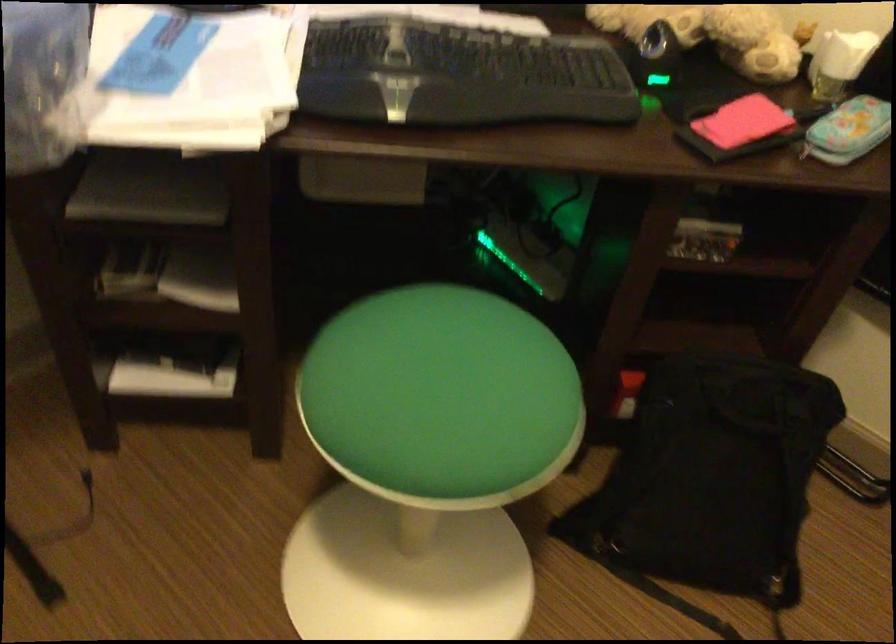
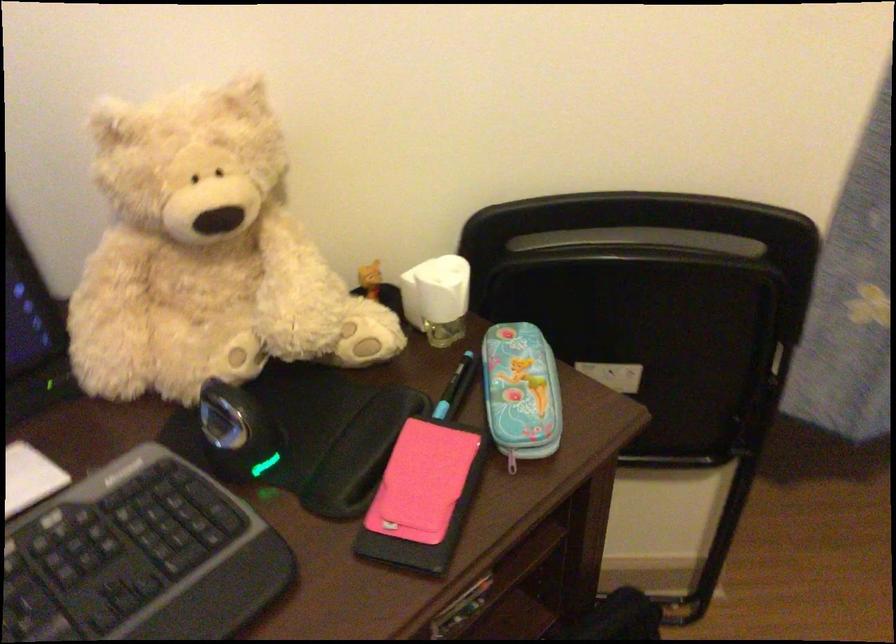
Question: How did the camera likely rotate?

Choices:
 (A) Left
 (B) Right
 (C) Up
 (D) Down

Answer: (B)